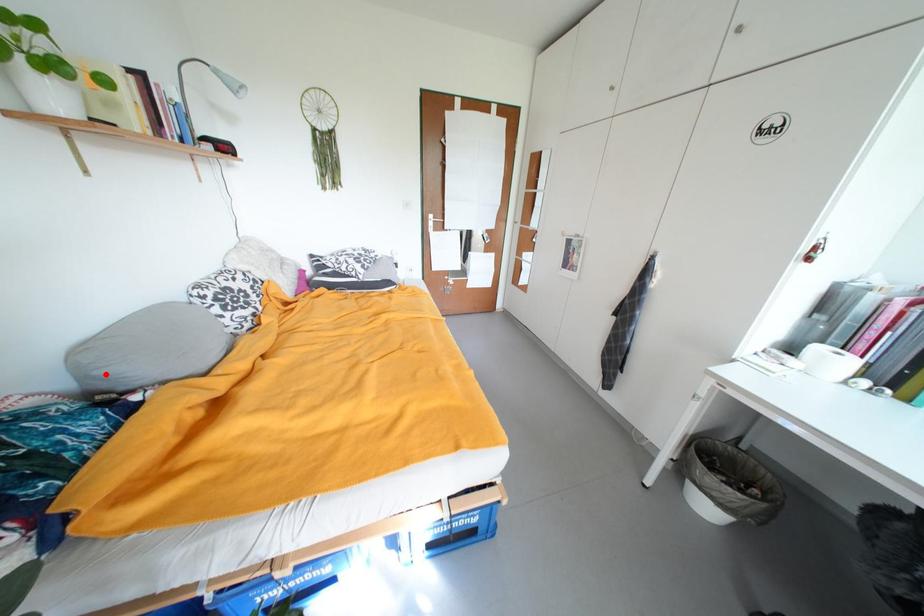
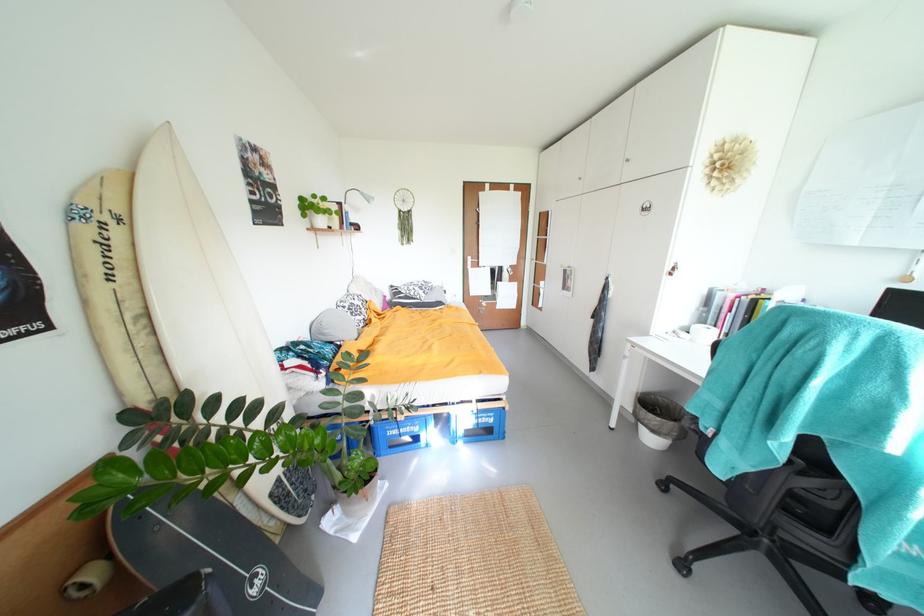
Question: I am providing you with two images of the same scene from different viewpoints. In image1, a red point is highlighted. Considering the same 3D point in image2, which of the following is correct?

Choices:
 (A) It is closer
 (B) It is farther

Answer: (A)